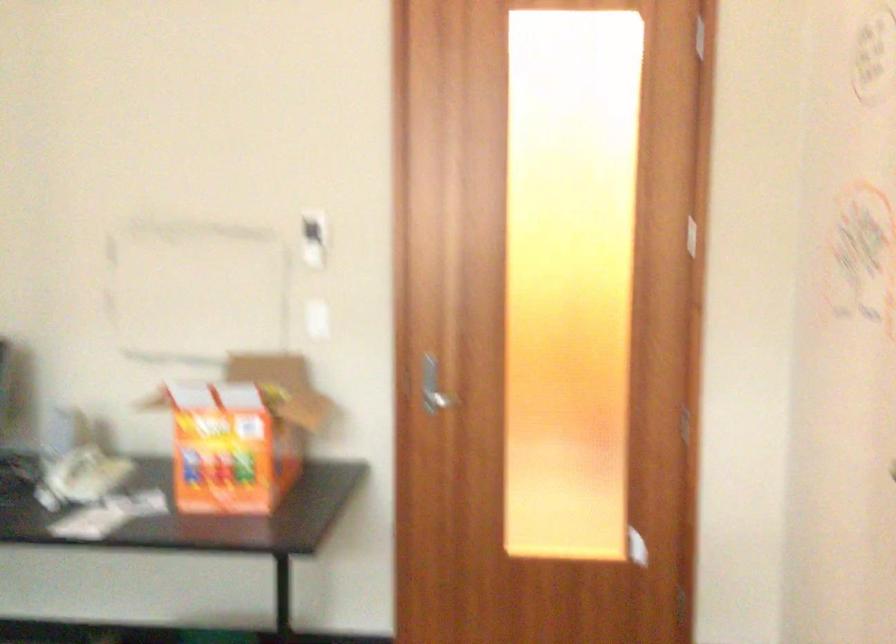
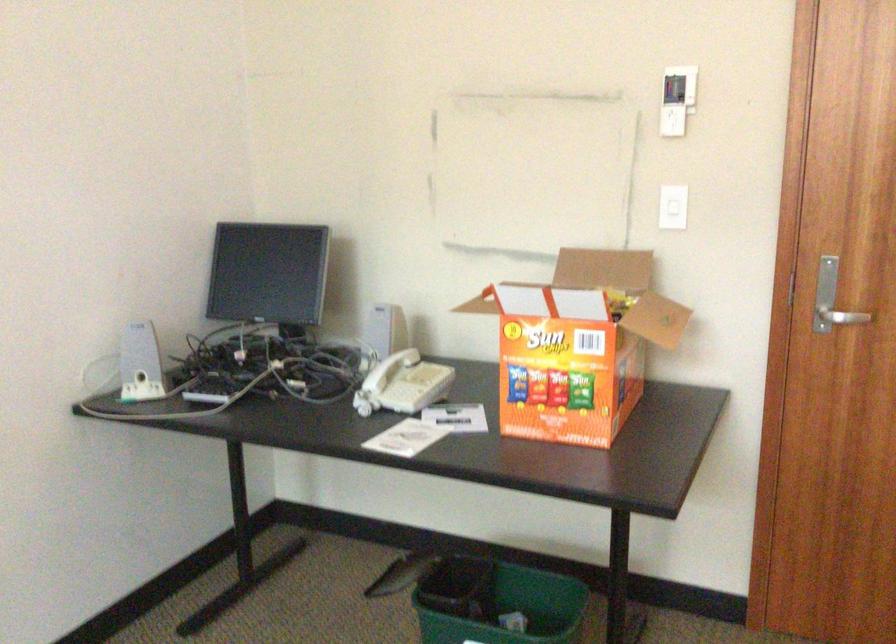
Locate, in the second image, the point that corresponds to point (312, 325) in the first image.

(672, 214)